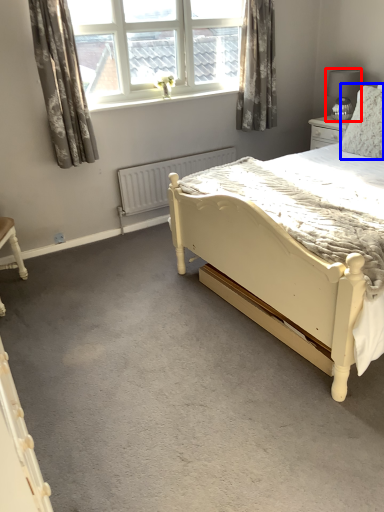
Question: Among these objects, which one is farthest to the camera, lamp (highlighted by a red box) or pillow (highlighted by a blue box)?

Choices:
 (A) lamp
 (B) pillow

Answer: (A)